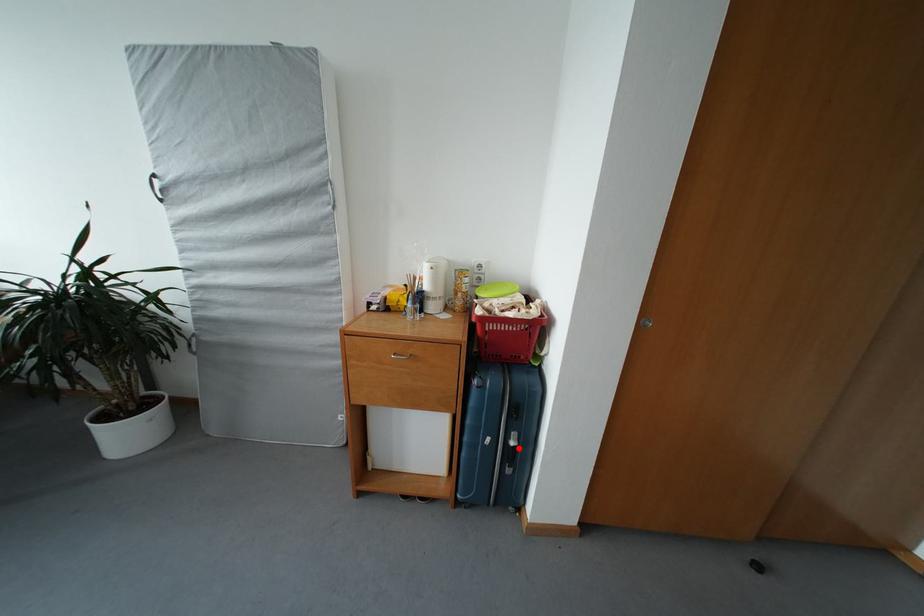
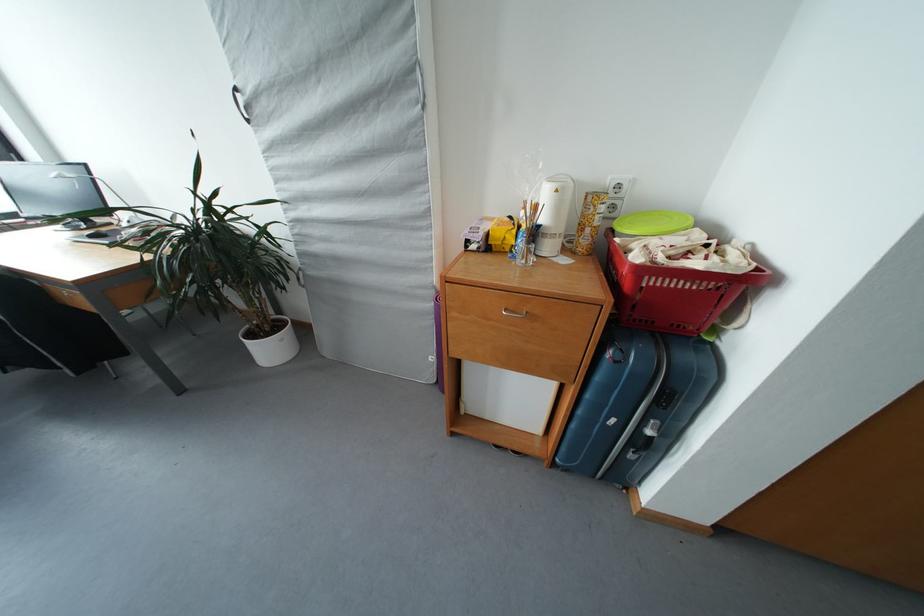
Question: I am providing you with two images of the same scene from different viewpoints. A red point is marked on the first image. Can you still see the location of the red point in image 2?

Choices:
 (A) Yes
 (B) No

Answer: (A)